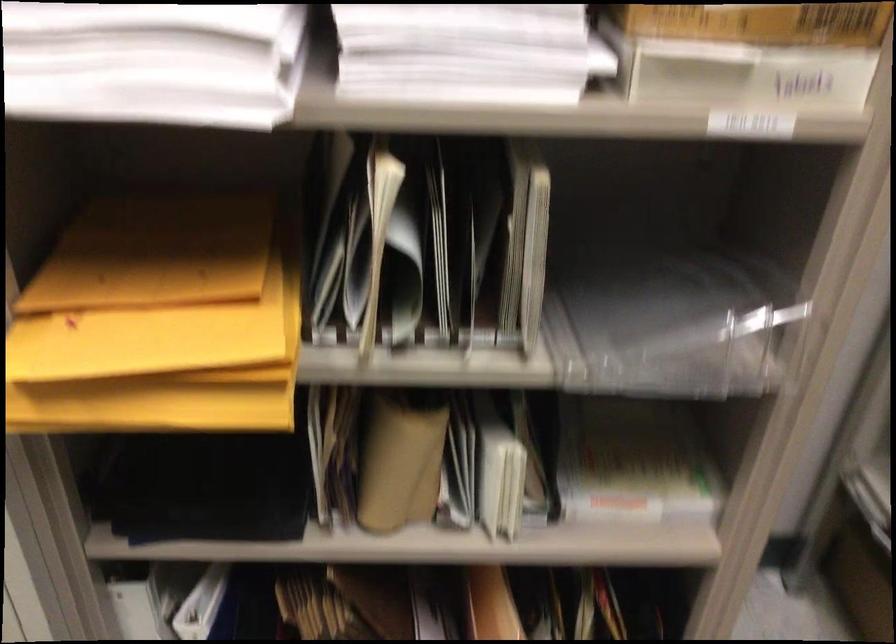
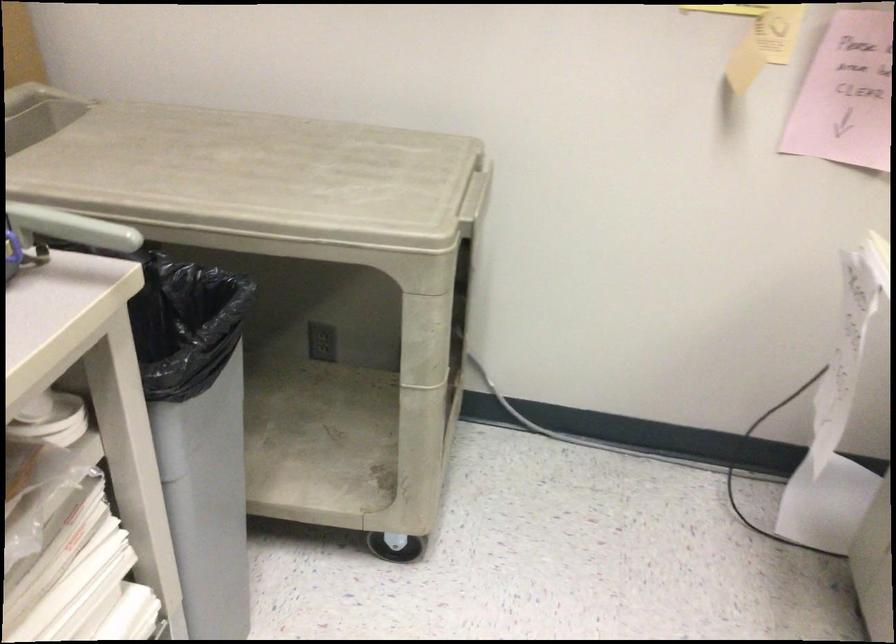
How did the camera likely rotate?

The camera rotated toward right-down.